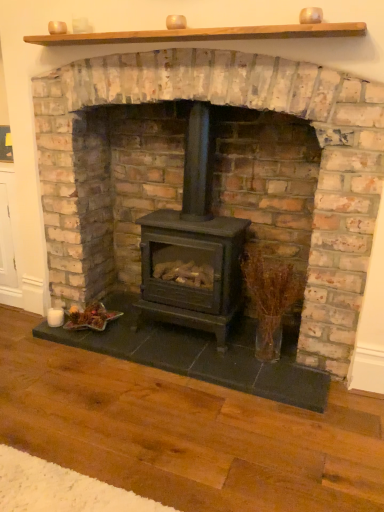
Find the location of a particular element. Image resolution: width=384 pixels, height=512 pixels. vacant area that is in front of translucent glass vase at right is located at coordinates (272, 379).